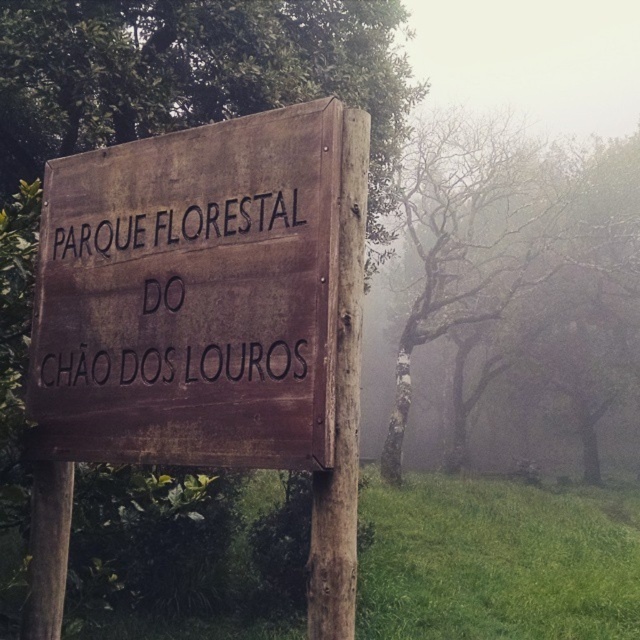
You are a hiker who has reached the entrance of the Forest Park of the Laurel Floor. You see the brown wooden sign at center and the green matte signpost at center. Which one is taller?

The green matte signpost at center is taller than the brown wooden sign at center.

You are standing at the wooden signpost in the forest and see two points marked on the ground. The first point is labeled as point (227,132) and the second is point (396,410). Which point is closer to you?

Point (227,132) is in front of point (396,410), so it is closer to you.